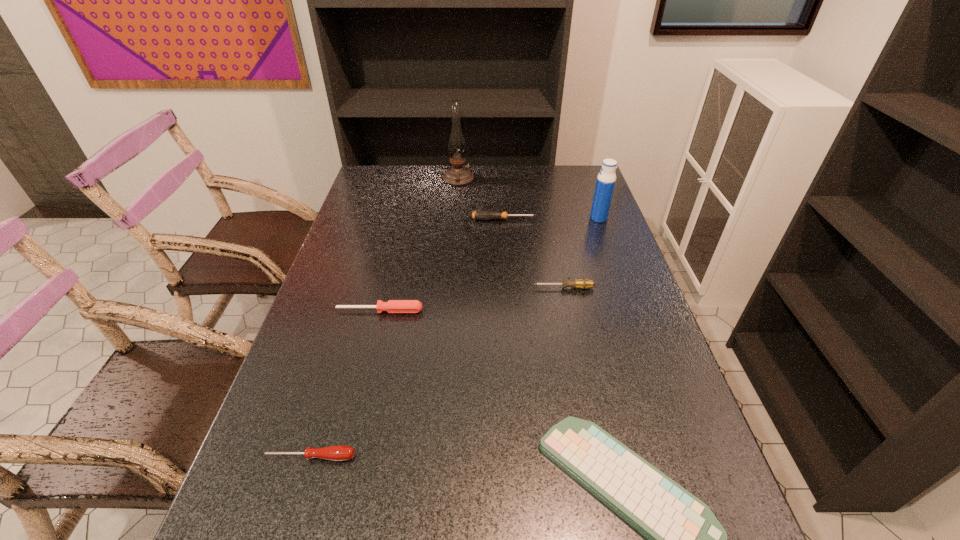
Find the location of a particular element. The width and height of the screenshot is (960, 540). free space at the right edge of the desktop is located at coordinates (733, 538).

At what (x,y) coordinates should I click in order to perform the action: click on vacant region at the far left corner of the desktop. Please return your answer as a coordinate pair (x, y). This screenshot has width=960, height=540. Looking at the image, I should click on (400, 165).

The image size is (960, 540). I want to click on vacant space at the far right corner, so click(552, 173).

Locate an element on the screen. Image resolution: width=960 pixels, height=540 pixels. vacant space that's between the sixth shortest object and the fourth farthest object is located at coordinates (581, 253).

This screenshot has height=540, width=960. Identify the location of empty space that is in between the nearest screwdriver and the water bottle. (453, 338).

Where is `free space between the farthest screwdriver and the farthest object`? The height and width of the screenshot is (540, 960). free space between the farthest screwdriver and the farthest object is located at coordinates (481, 199).

Locate an element on the screen. vacant area that lies between the third nearest screwdriver and the nearest screwdriver is located at coordinates (436, 373).

I want to click on vacant space that is in between the third nearest object and the nearest screwdriver, so click(x=345, y=384).

Locate an element on the screen. unoccupied position between the tallest object and the farthest screwdriver is located at coordinates (481, 199).

This screenshot has width=960, height=540. Find the location of `vacant space in between the farthest screwdriver and the sixth shortest object`. vacant space in between the farthest screwdriver and the sixth shortest object is located at coordinates (551, 219).